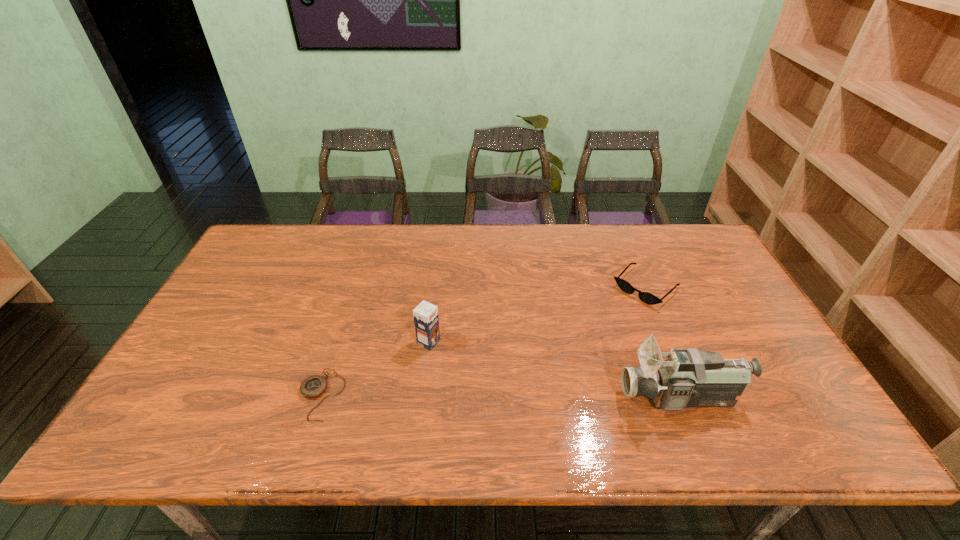
The image size is (960, 540). Find the location of `free point located 0.050m on the front-facing side of the camcorder`. free point located 0.050m on the front-facing side of the camcorder is located at coordinates (601, 397).

The image size is (960, 540). What are the coordinates of `vacant region located 0.150m on the front-facing side of the farthest object` in the screenshot? It's located at pos(601,332).

Find the location of a particular element. vacant area located 0.060m on the front-facing side of the farthest object is located at coordinates (618, 314).

Where is `free space located 0.360m on the front-facing side of the farthest object`? This screenshot has height=540, width=960. free space located 0.360m on the front-facing side of the farthest object is located at coordinates point(555,377).

Where is `free point located on the front label of the third object from right to left`? This screenshot has width=960, height=540. free point located on the front label of the third object from right to left is located at coordinates [533, 394].

This screenshot has height=540, width=960. What are the coordinates of `vacant area situated on the front label of the third object from right to left` in the screenshot? It's located at (564, 410).

In order to click on vacant space situated on the front label of the third object from right to left in this screenshot , I will do `click(564, 410)`.

Locate an element on the screen. The width and height of the screenshot is (960, 540). object located at the far edge is located at coordinates (648, 298).

Find the location of `pocket watch that is at the near edge`. pocket watch that is at the near edge is located at coordinates (314, 386).

Where is `camcorder present at the near edge`? camcorder present at the near edge is located at coordinates (690, 377).